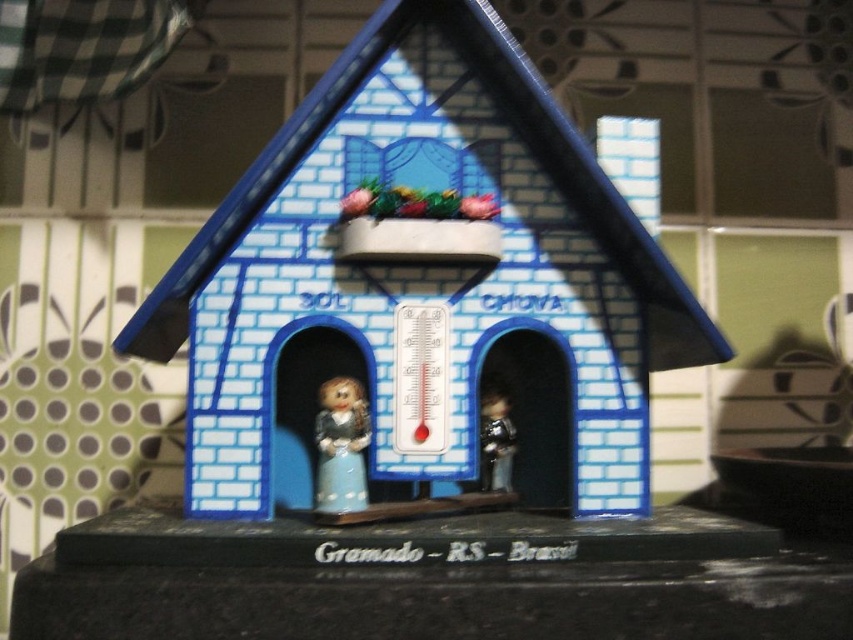
You are an interior designer arranging miniature furniture for the decorative house model. You need to place a 3cm tall accessory next to the taller object. Which object should you choose between the matte porcelain doll at lower left and the metallic silver figurine at center?

The matte porcelain doll at lower left is taller than the metallic silver figurine at center, so you should place the 3cm tall accessory next to the matte porcelain doll at lower left.

You are holding a 36 inch ruler and want to measure the distance between yourself and the blue painted wood thermometer at center. Can you reach it without moving your hand?

The blue painted wood thermometer at center is 36.67 inches away from camera. Since your ruler is only 36 inches long, you cannot reach it without moving your hand.